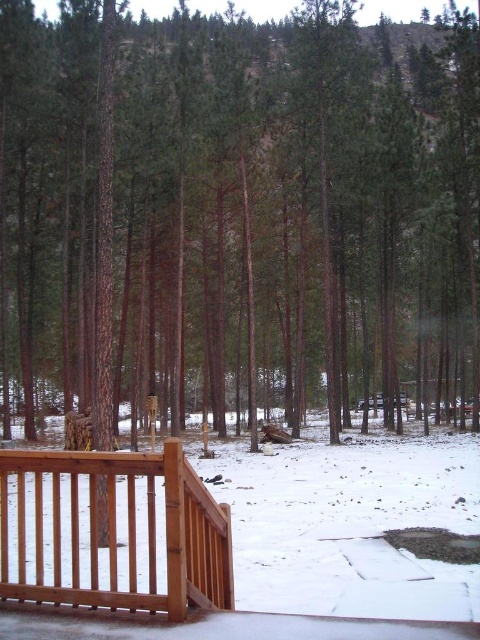
Can you confirm if brown wood tree at center is positioned above wooden railing at lower left?

Yes, brown wood tree at center is above wooden railing at lower left.

Is point (294, 240) positioned after point (200, 573)?

Yes.

Is point (127, 76) in front of point (47, 580)?

No, it is behind (47, 580).

What are the coordinates of `brown wood tree at center` in the screenshot? It's located at (238, 214).

Is brown wood tree at center positioned before brown wooden porch at lower left?

No.

Is brown wood tree at center to the right of brown wooden porch at lower left from the viewer's perspective?

Correct, you'll find brown wood tree at center to the right of brown wooden porch at lower left.

Which is behind, point (1, 145) or point (17, 474)?

Point (1, 145)

Locate an element on the screen. Image resolution: width=480 pixels, height=640 pixels. brown wood tree at center is located at coordinates (238, 214).

Does brown wooden porch at lower left appear under wooden railing at lower left?

Correct, brown wooden porch at lower left is located below wooden railing at lower left.

Does brown wooden porch at lower left have a greater height compared to wooden railing at lower left?

Yes.

Does point (179, 625) come behind point (112, 468)?

No, it is in front of (112, 468).

Find the location of a particular element. This screenshot has width=480, height=640. brown wooden porch at lower left is located at coordinates (254, 541).